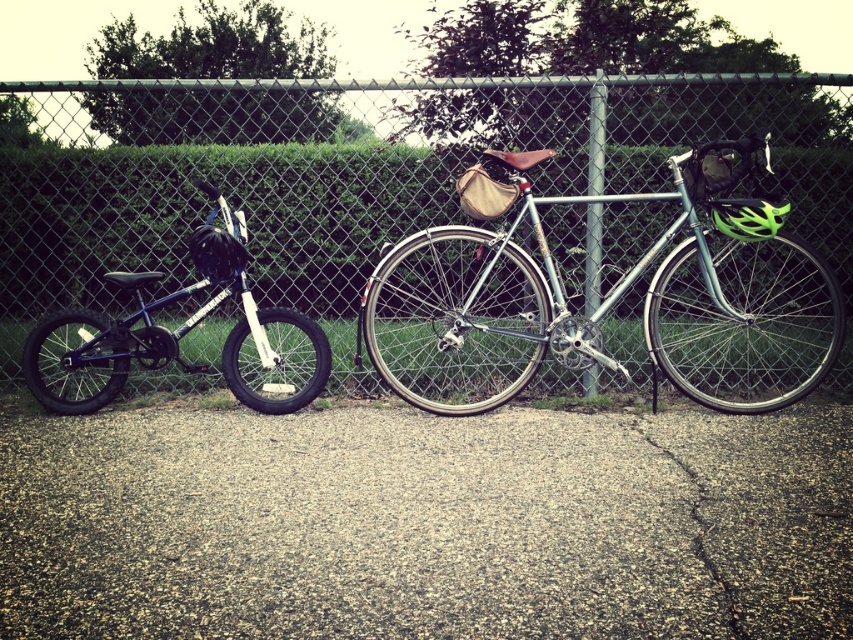
You are a delivery person who needs to choose a bicycle to carry heavy packages. You see the silver metallic bicycle at center and the shiny blue bicycle at left. Which bicycle should you choose based on their sizes?

The silver metallic bicycle at center is bigger than the shiny blue bicycle at left, so you should choose the silver metallic bicycle at center because it can carry heavier loads due to its larger size.